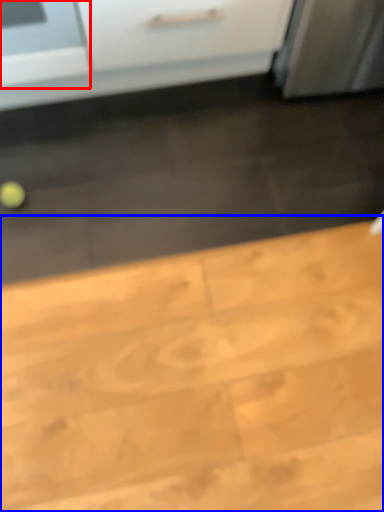
Question: Which of the following is the closest to the observer, appliance (highlighted by a red box) or table (highlighted by a blue box)?

Choices:
 (A) appliance
 (B) table

Answer: (B)